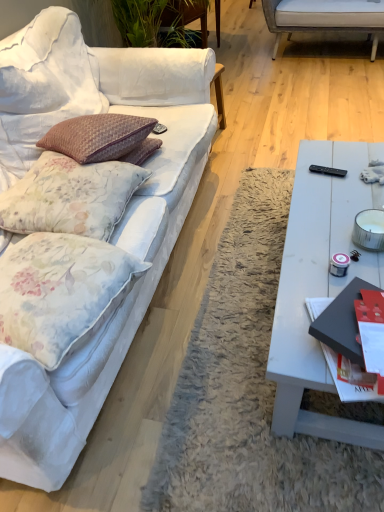
Locate an element on the screen. vacant area that lies between red glossy magazine at right and black plastic remote control at right is located at coordinates (326, 224).